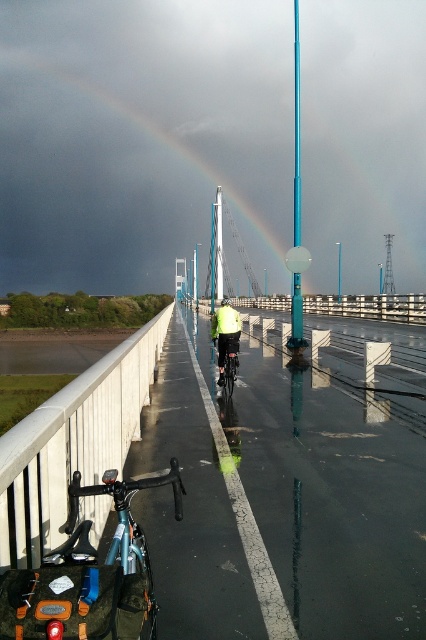
Question: Estimate the real-world distances between objects in this image. Which object is closer to the teal glossy pole at center?

Choices:
 (A) blue glossy pole at center
 (B) shiny metallic bicycle at center
 (C) shiny metallic bicycle at lower left

Answer: (B)

Question: Can you confirm if teal glossy pole at center is positioned to the left of high visibility yellow jacket at center?

Choices:
 (A) yes
 (B) no

Answer: (B)

Question: Which of the following is the closest to the observer?

Choices:
 (A) teal glossy pole at center
 (B) shiny metallic bicycle at lower left
 (C) high visibility yellow jacket at center

Answer: (B)

Question: Among these points, which one is farthest from the camera?

Choices:
 (A) (236, 316)
 (B) (294, 116)

Answer: (B)

Question: Is shiny metallic bicycle at lower left smaller than high visibility yellow jacket at center?

Choices:
 (A) no
 (B) yes

Answer: (B)

Question: Considering the relative positions of shiny metallic bicycle at lower left and teal glossy pole at center in the image provided, where is shiny metallic bicycle at lower left located with respect to teal glossy pole at center?

Choices:
 (A) above
 (B) below

Answer: (B)